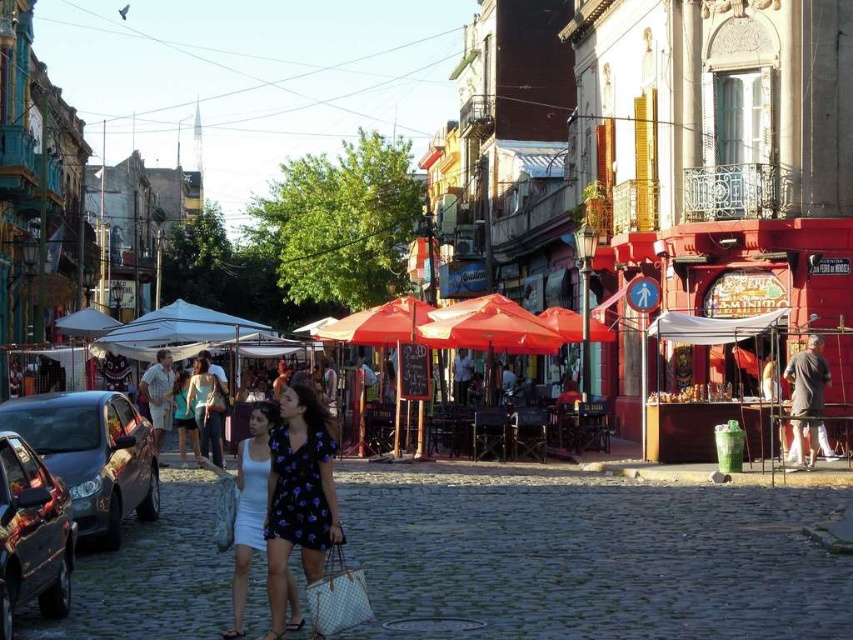
Is shiny metallic car at lower left shorter than white fabric dress at center?

Correct, shiny metallic car at lower left is not as tall as white fabric dress at center.

Can you confirm if shiny metallic car at lower left is wider than white fabric dress at center?

No, shiny metallic car at lower left is not wider than white fabric dress at center.

Identify the location of shiny metallic car at lower left. The height and width of the screenshot is (640, 853). (32, 534).

Between shiny metallic car at left and matte blue dress at center, which one appears on the left side from the viewer's perspective?

matte blue dress at center is more to the left.

Looking at this image, is shiny metallic car at left to the left of matte blue dress at center from the viewer's perspective?

Incorrect, shiny metallic car at left is not on the left side of matte blue dress at center.

Is point (78, 442) farther from viewer compared to point (184, 408)?

No.

Image resolution: width=853 pixels, height=640 pixels. I want to click on shiny metallic car at left, so click(x=91, y=456).

Is shiny metallic car at lower left closer to the viewer compared to matte red umbrella at center?

Yes, it is in front of matte red umbrella at center.

Is point (59, 595) closer to viewer compared to point (543, 330)?

Yes, it is in front of point (543, 330).

Where is `shiny metallic car at lower left`? This screenshot has width=853, height=640. shiny metallic car at lower left is located at coordinates (32, 534).